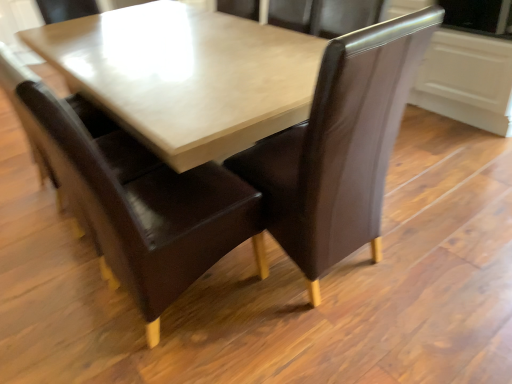
Question: Is brown leather chair at center, the 1th chair when ordered from right to left, turned away from brown leather chair at center, the 2th chair in the right-to-left sequence?

Choices:
 (A) yes
 (B) no

Answer: (B)

Question: From a real-world perspective, does brown leather chair at center, which appears as the second chair when viewed from the left, stand above brown leather chair at center, the first chair in the left-to-right sequence?

Choices:
 (A) yes
 (B) no

Answer: (B)

Question: Considering the relative sizes of brown leather chair at center, the 1th chair when ordered from right to left, and brown leather chair at center, the first chair in the left-to-right sequence, in the image provided, is brown leather chair at center, the 1th chair when ordered from right to left, shorter than brown leather chair at center, the first chair in the left-to-right sequence,?

Choices:
 (A) yes
 (B) no

Answer: (A)

Question: Is brown leather chair at center, which appears as the second chair when viewed from the left, smaller than brown leather chair at center, the first chair in the left-to-right sequence?

Choices:
 (A) yes
 (B) no

Answer: (A)

Question: Considering the relative positions of brown leather chair at center, which appears as the second chair when viewed from the left, and brown leather chair at center, the 2th chair in the right-to-left sequence, in the image provided, is brown leather chair at center, which appears as the second chair when viewed from the left, in front of brown leather chair at center, the 2th chair in the right-to-left sequence,?

Choices:
 (A) no
 (B) yes

Answer: (A)

Question: Can you confirm if brown leather chair at center, the 1th chair when ordered from right to left, is thinner than brown leather chair at center, the 2th chair in the right-to-left sequence?

Choices:
 (A) yes
 (B) no

Answer: (A)

Question: Is brown leather chair at center, the 2th chair in the right-to-left sequence, in front of brown leather chair at center, which appears as the second chair when viewed from the left?

Choices:
 (A) yes
 (B) no

Answer: (A)

Question: From a real-world perspective, is brown leather chair at center, the first chair in the left-to-right sequence, located beneath brown leather chair at center, which appears as the second chair when viewed from the left?

Choices:
 (A) no
 (B) yes

Answer: (A)

Question: Is brown leather chair at center, the 1th chair when ordered from right to left, surrounded by brown leather chair at center, the first chair in the left-to-right sequence?

Choices:
 (A) yes
 (B) no

Answer: (B)

Question: Is brown leather chair at center, the 2th chair in the right-to-left sequence, shorter than brown leather chair at center, which appears as the second chair when viewed from the left?

Choices:
 (A) yes
 (B) no

Answer: (B)

Question: Is brown leather chair at center, the first chair in the left-to-right sequence, facing towards brown leather chair at center, the 1th chair when ordered from right to left?

Choices:
 (A) no
 (B) yes

Answer: (B)

Question: Is brown leather chair at center, the first chair in the left-to-right sequence, positioned behind brown leather chair at center, the 1th chair when ordered from right to left?

Choices:
 (A) no
 (B) yes

Answer: (A)

Question: Considering the positions of brown leather chair at center, the first chair in the left-to-right sequence, and brown leather chair at center, the 1th chair when ordered from right to left, in the image, is brown leather chair at center, the first chair in the left-to-right sequence, taller or shorter than brown leather chair at center, the 1th chair when ordered from right to left,?

Choices:
 (A) tall
 (B) short

Answer: (A)